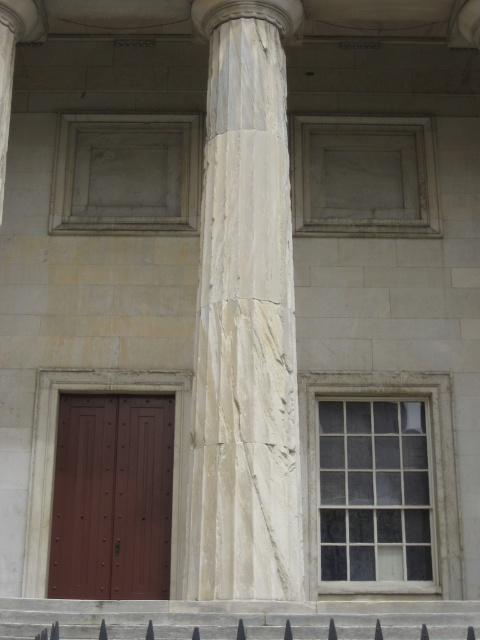
You are standing in front of the classical building and want to take a photo of the white marble column at center and the black metal fence at lower center. If you want to include both objects in the same frame, should you zoom in or zoom out?

The white marble column at center is above the black metal fence at lower center, so you should zoom out to include both in the frame.

Based on the photo, you are a painter standing at the base of the white marble column at center. You want to paint the black metal fence at lower center. Can you see the entire fence without moving your position?

The white marble column at center is taller than the black metal fence at lower center, so yes, you can see the entire fence without moving your position because the column does not block your view.